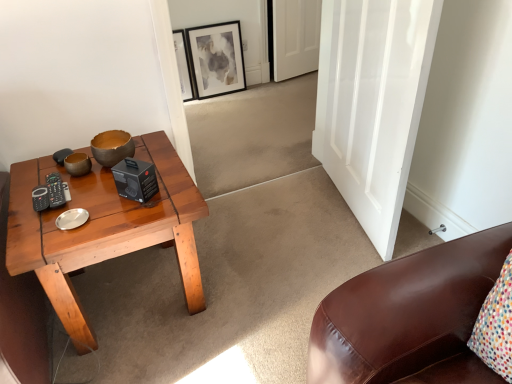
Find the location of a particular element. This screenshot has width=512, height=384. spots to the right of wooden coffee table at left is located at coordinates (257, 280).